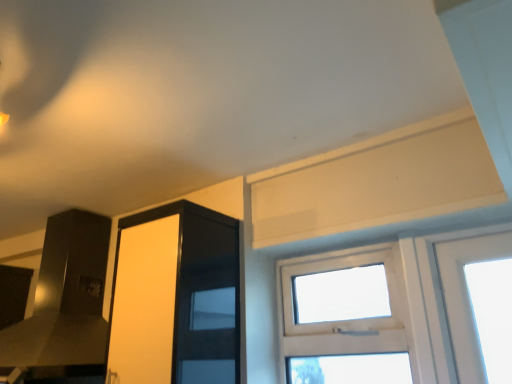
Question: From the image's perspective, does transparent glass screen door at upper left appear higher than transparent glass window at center?

Choices:
 (A) no
 (B) yes

Answer: (B)

Question: Is transparent glass window at center at the back of transparent glass screen door at upper left?

Choices:
 (A) yes
 (B) no

Answer: (B)

Question: Considering the relative sizes of transparent glass screen door at upper left and transparent glass window at center in the image provided, is transparent glass screen door at upper left wider than transparent glass window at center?

Choices:
 (A) no
 (B) yes

Answer: (B)

Question: Does transparent glass screen door at upper left touch transparent glass window at center?

Choices:
 (A) yes
 (B) no

Answer: (B)

Question: Is transparent glass screen door at upper left outside of transparent glass window at center?

Choices:
 (A) yes
 (B) no

Answer: (A)

Question: Can you confirm if transparent glass screen door at upper left is shorter than transparent glass window at center?

Choices:
 (A) yes
 (B) no

Answer: (B)

Question: From the image's perspective, is transparent glass window at center located beneath transparent glass screen door at upper left?

Choices:
 (A) no
 (B) yes

Answer: (B)

Question: Considering the relative sizes of transparent glass window at center and transparent glass screen door at upper left in the image provided, is transparent glass window at center bigger than transparent glass screen door at upper left?

Choices:
 (A) no
 (B) yes

Answer: (A)

Question: Does transparent glass window at center have a lesser height compared to transparent glass screen door at upper left?

Choices:
 (A) no
 (B) yes

Answer: (B)

Question: Is transparent glass screen door at upper left at the back of transparent glass window at center?

Choices:
 (A) no
 (B) yes

Answer: (A)

Question: Considering the relative sizes of transparent glass window at center and transparent glass screen door at upper left in the image provided, is transparent glass window at center wider than transparent glass screen door at upper left?

Choices:
 (A) yes
 (B) no

Answer: (B)

Question: Is transparent glass window at center outside of transparent glass screen door at upper left?

Choices:
 (A) no
 (B) yes

Answer: (B)

Question: Relative to transparent glass screen door at upper left, is transparent glass window at center in front or behind?

Choices:
 (A) behind
 (B) front

Answer: (A)